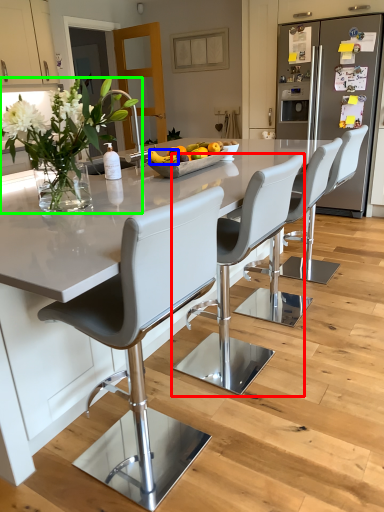
Question: Which object is the farthest from chair (highlighted by a red box)? Choose among these: fruit (highlighted by a blue box) or floral arrangement (highlighted by a green box).

Choices:
 (A) fruit
 (B) floral arrangement

Answer: (B)